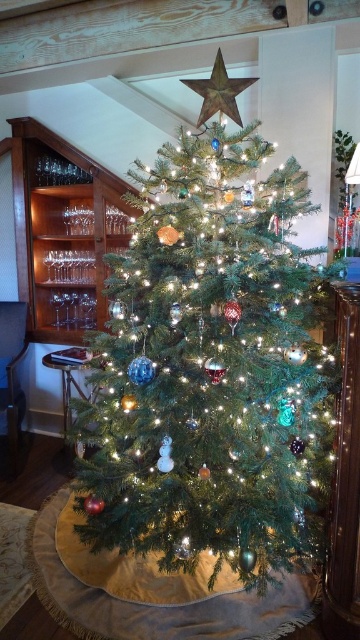
Question: Among these objects, which one is nearest to the camera?

Choices:
 (A) green matte christmas tree at center
 (B) metallic gold star at upper center

Answer: (A)

Question: Which object appears farthest from the camera in this image?

Choices:
 (A) metallic gold star at upper center
 (B) green matte christmas tree at center

Answer: (A)

Question: Can you confirm if green matte christmas tree at center is positioned above metallic gold star at upper center?

Choices:
 (A) yes
 (B) no

Answer: (B)

Question: Is green matte christmas tree at center positioned at the back of metallic gold star at upper center?

Choices:
 (A) yes
 (B) no

Answer: (B)

Question: Among these objects, which one is farthest from the camera?

Choices:
 (A) metallic gold star at upper center
 (B) green matte christmas tree at center

Answer: (A)

Question: Can you confirm if green matte christmas tree at center is smaller than metallic gold star at upper center?

Choices:
 (A) yes
 (B) no

Answer: (B)